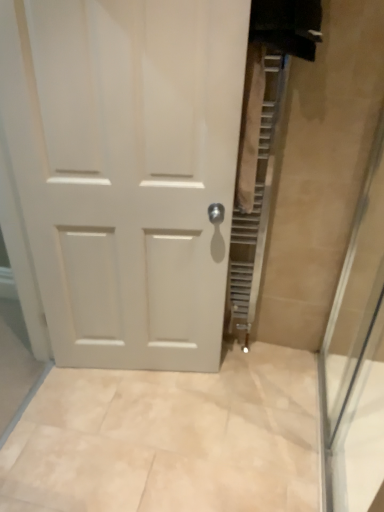
The height and width of the screenshot is (512, 384). What do you see at coordinates (127, 170) in the screenshot?
I see `white matte door at center` at bounding box center [127, 170].

Locate an element on the screen. This screenshot has width=384, height=512. white matte door at center is located at coordinates (127, 170).

This screenshot has width=384, height=512. Describe the element at coordinates (356, 357) in the screenshot. I see `transparent glass shower door at right` at that location.

Find the location of a particular element. This screenshot has height=512, width=384. transparent glass shower door at right is located at coordinates (356, 357).

In order to face transparent glass shower door at right, should I rotate leftwards or rightwards?

Turn right by 21.066 degrees to look at transparent glass shower door at right.

Measure the distance between transparent glass shower door at right and camera.

A distance of 1.48 meters exists between transparent glass shower door at right and camera.

What is the approximate height of transparent glass shower door at right?

transparent glass shower door at right is 1.30 meters tall.

Find the location of a particular element. This screenshot has width=384, height=512. white matte door at center is located at coordinates (127, 170).

Which is more to the right, white matte door at center or transparent glass shower door at right?

From the viewer's perspective, transparent glass shower door at right appears more on the right side.

Considering the relative positions of white matte door at center and transparent glass shower door at right in the image provided, is white matte door at center behind transparent glass shower door at right?

Yes.

Is point (156, 278) closer or farther from the camera than point (373, 444)?

Point (156, 278).

From the image's perspective, is white matte door at center over transparent glass shower door at right?

Correct, white matte door at center appears higher than transparent glass shower door at right in the image.

From a real-world perspective, does white matte door at center sit lower than transparent glass shower door at right?

Actually, white matte door at center is physically above transparent glass shower door at right in the real world.

Considering the relative sizes of white matte door at center and transparent glass shower door at right in the image provided, is white matte door at center thinner than transparent glass shower door at right?

No.

From their relative heights in the image, would you say white matte door at center is taller or shorter than transparent glass shower door at right?

In the image, white matte door at center appears to be taller than transparent glass shower door at right.

Consider the image. In terms of size, does white matte door at center appear bigger or smaller than transparent glass shower door at right?

Clearly, white matte door at center is larger in size than transparent glass shower door at right.

Choose the correct answer: Is white matte door at center inside transparent glass shower door at right or outside it?

white matte door at center is not enclosed by transparent glass shower door at right.

Is white matte door at center touching transparent glass shower door at right?

No, white matte door at center is not next to transparent glass shower door at right.

Is white matte door at center looking in the opposite direction of transparent glass shower door at right?

white matte door at center does not have its back to transparent glass shower door at right.

Locate an element on the screen. This screenshot has width=384, height=512. shower door that is on the right side of white matte door at center is located at coordinates click(x=356, y=357).

Considering the relative positions of transparent glass shower door at right and white matte door at center in the image provided, is transparent glass shower door at right to the left of white matte door at center from the viewer's perspective?

In fact, transparent glass shower door at right is to the right of white matte door at center.

Which is in front, transparent glass shower door at right or white matte door at center?

Positioned in front is transparent glass shower door at right.

Considering the points (336, 374) and (98, 21), which point is in front, point (336, 374) or point (98, 21)?

The point (98, 21) is in front.

From the image's perspective, which one is positioned lower, transparent glass shower door at right or white matte door at center?

transparent glass shower door at right is shown below in the image.

From a real-world perspective, is transparent glass shower door at right above or below white matte door at center?

From a real-world perspective, transparent glass shower door at right is physically below white matte door at center.

Between transparent glass shower door at right and white matte door at center, which one has smaller width?

transparent glass shower door at right.

In terms of height, does transparent glass shower door at right look taller or shorter compared to white matte door at center?

In the image, transparent glass shower door at right appears to be shorter than white matte door at center.

In terms of size, does transparent glass shower door at right appear bigger or smaller than white matte door at center?

transparent glass shower door at right is smaller than white matte door at center.

Is transparent glass shower door at right surrounding white matte door at center?

No, white matte door at center is not a part of transparent glass shower door at right.

Are transparent glass shower door at right and white matte door at center located far from each other?

No, transparent glass shower door at right is not far from white matte door at center.

From the picture: Is transparent glass shower door at right aimed at white matte door at center?

Yes, transparent glass shower door at right is aimed at white matte door at center.

What's the angular difference between transparent glass shower door at right and white matte door at center's facing directions?

101 degrees separate the facing orientations of transparent glass shower door at right and white matte door at center.

Identify the location of door that appears above the transparent glass shower door at right (from a real-world perspective). (127, 170).

I want to click on shower door that is below the white matte door at center (from the image's perspective), so click(x=356, y=357).

Identify the location of door above the transparent glass shower door at right (from the image's perspective). coord(127,170).